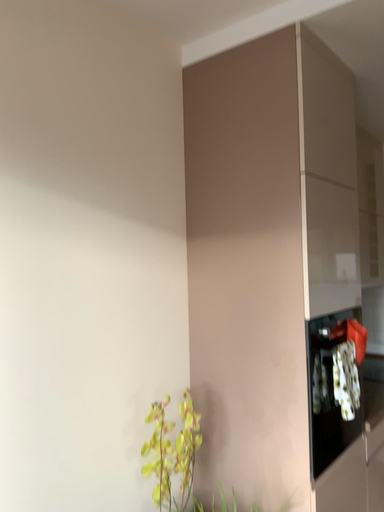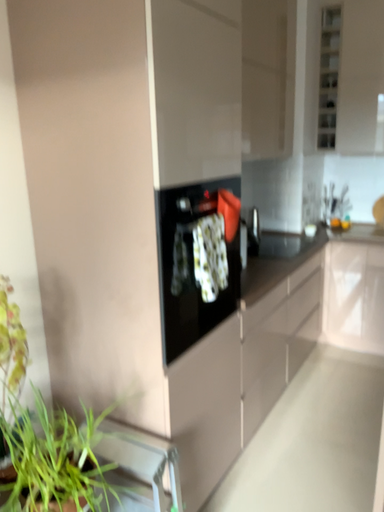
Question: Which way did the camera rotate in the video?

Choices:
 (A) rotated downward
 (B) rotated upward

Answer: (A)